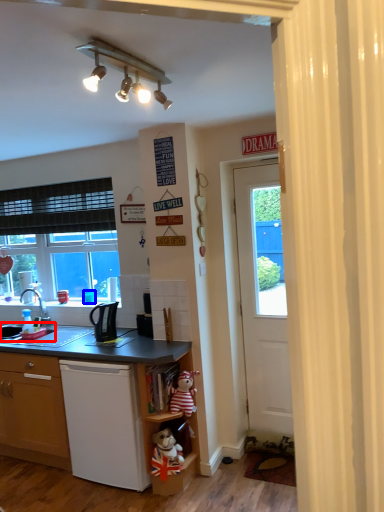
Question: Which object appears farthest to the camera in this image, sink (highlighted by a red box) or coffee cup (highlighted by a blue box)?

Choices:
 (A) sink
 (B) coffee cup

Answer: (B)